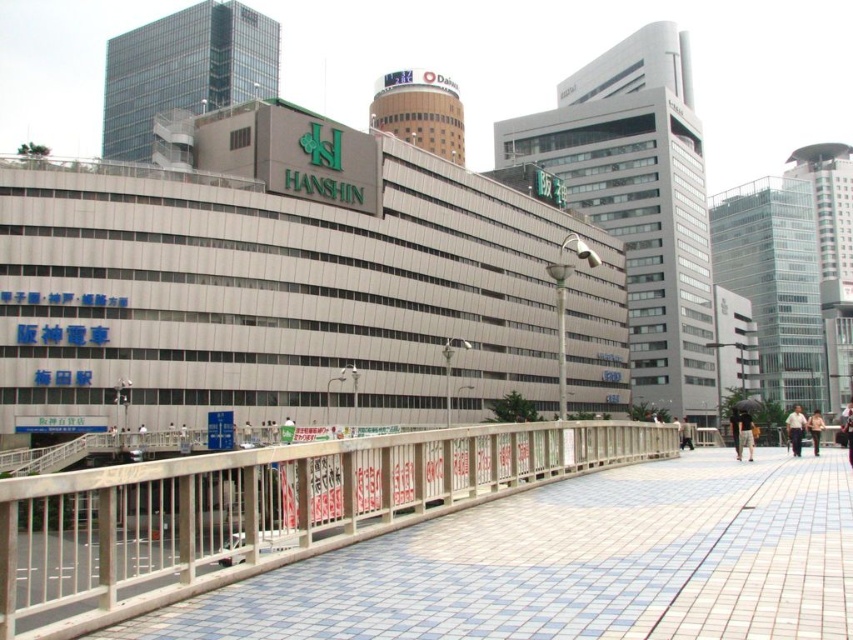
You are standing at the center of the HANSHIN building. Which direction should you walk to reach the blue tile pavement at lower left?

The blue tile pavement at lower left is located at point (573, 564) in 2D coordinates, so you should walk towards the lower left direction to reach it.

You are a photographer standing on the walkway in front of the HANSHIN building. You notice two people wearing light brown fabric shirt at right and light brown leather jacket at lower right. Which clothing item takes up more space?

The light brown leather jacket at lower right takes up more space than the light brown fabric shirt at right because the light brown fabric shirt at right occupies less space than light brown leather jacket at lower right.

You are a photographer standing on the walkway in front of the HANSHIN building. You notice two people wearing a dark brown leather jacket at center and a light brown fabric shirt at right. Which person is closer to the HANSHIN building?

The dark brown leather jacket at center is to the left of the light brown fabric shirt at right, so the person wearing the dark brown leather jacket at center is closer to the HANSHIN building.